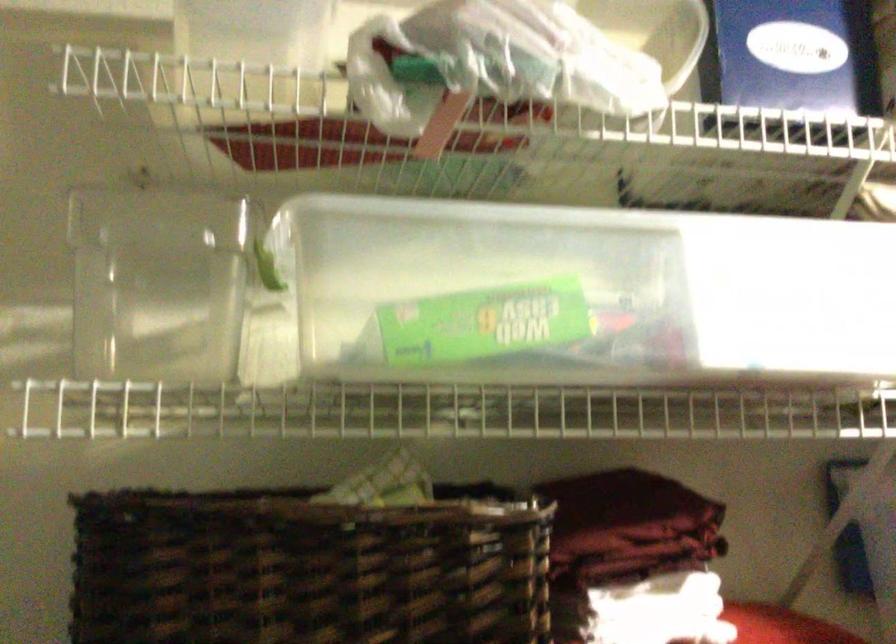
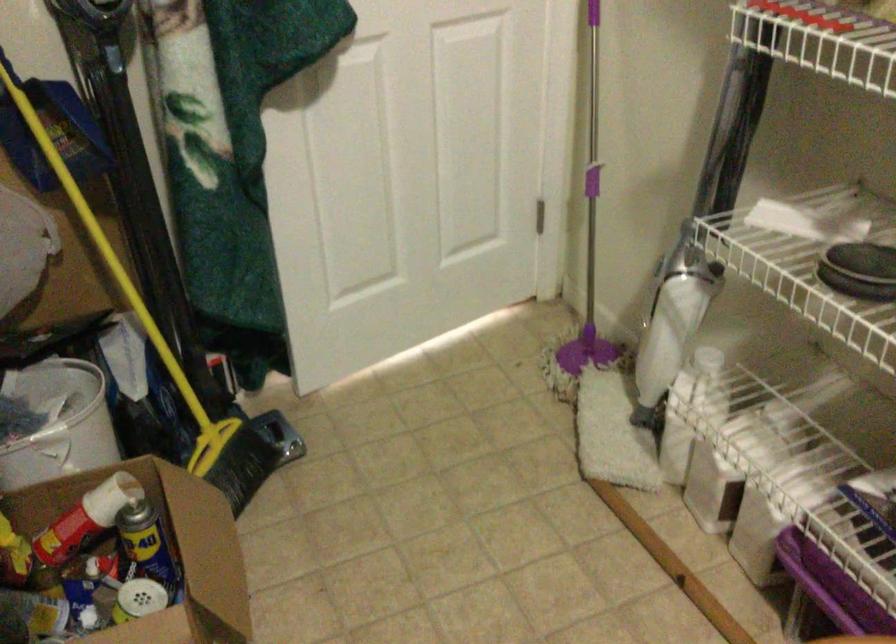
How did the camera likely rotate?

The camera rotated toward left-down.